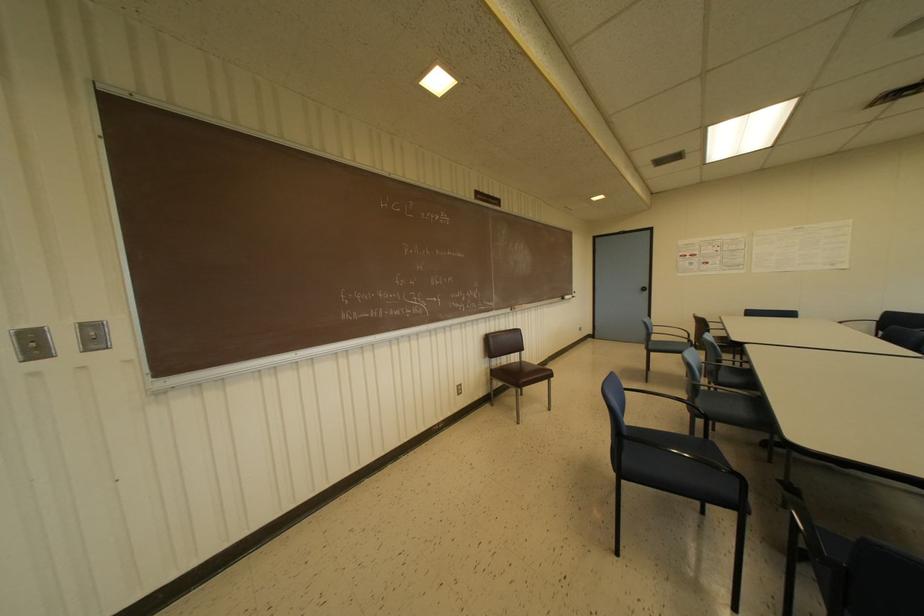
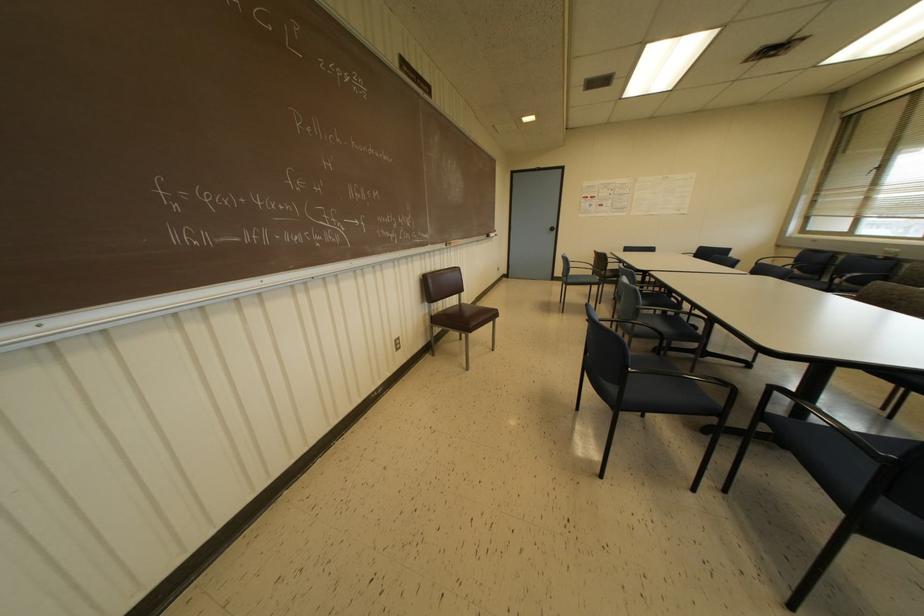
Question: The images are taken continuously from a first-person perspective. In which direction is your viewpoint rotating?

Choices:
 (A) Left
 (B) Right
 (C) Up
 (D) Down

Answer: (B)